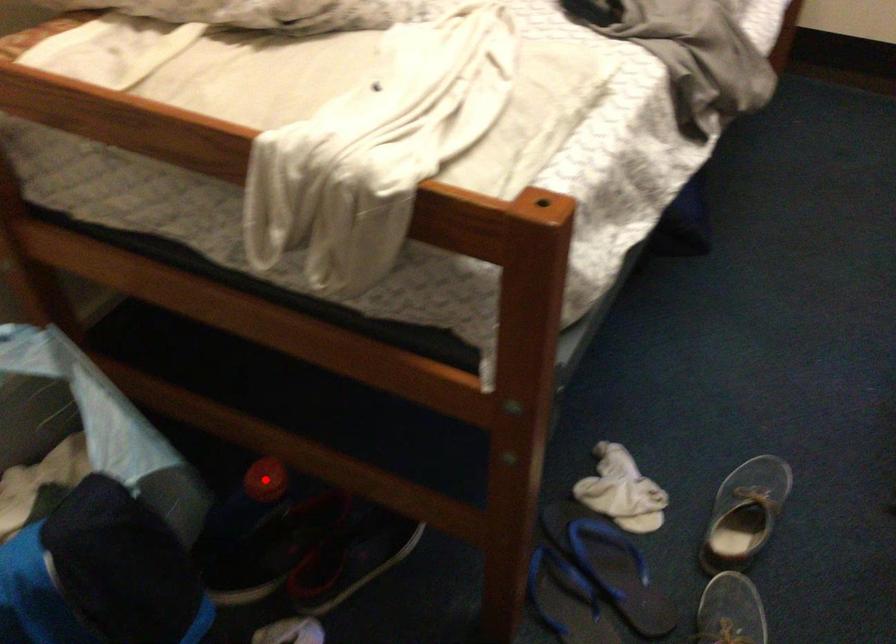
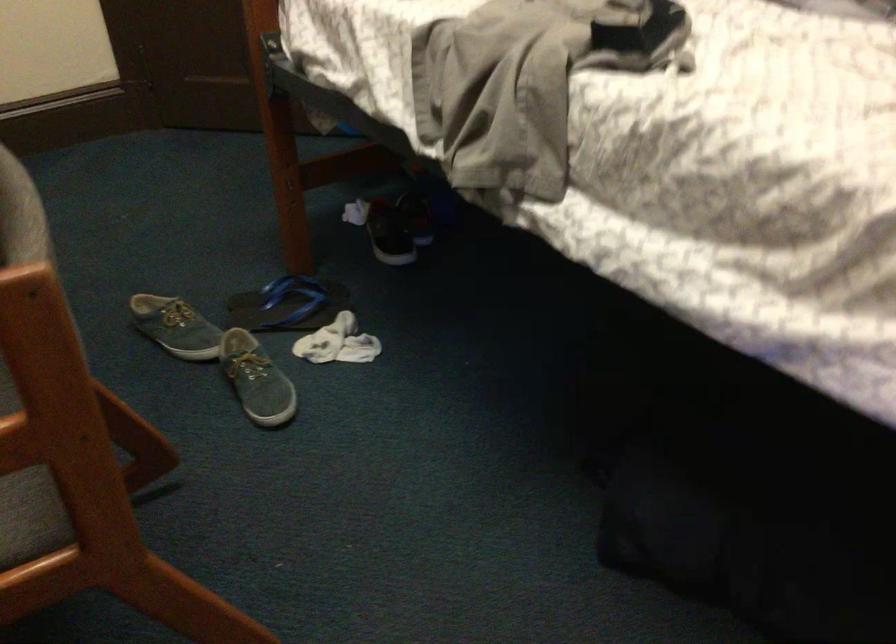
Question: I am providing you with two images of the same scene from different viewpoints. A red point is marked on the first image. Can you still see the location of the red point in image 2?

Choices:
 (A) Yes
 (B) No

Answer: (B)